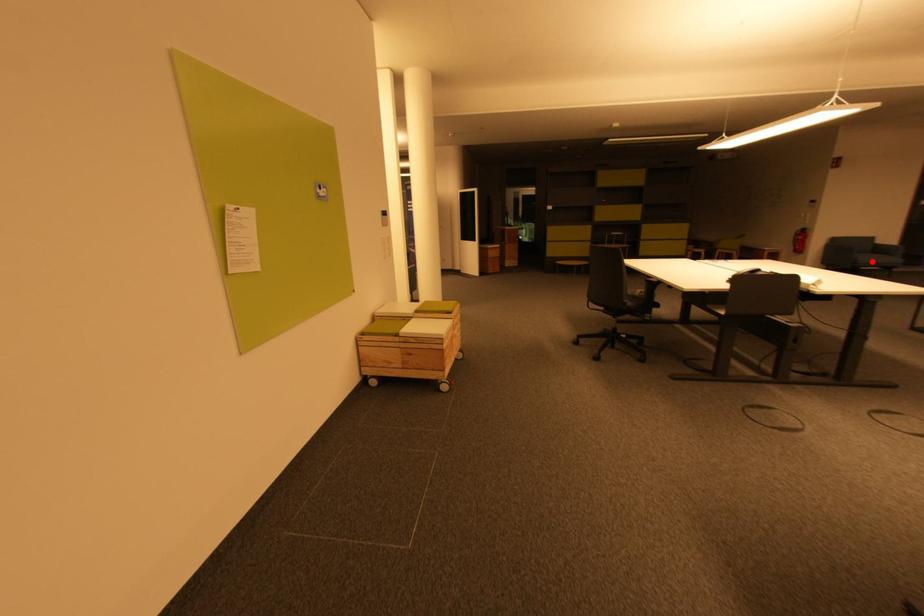
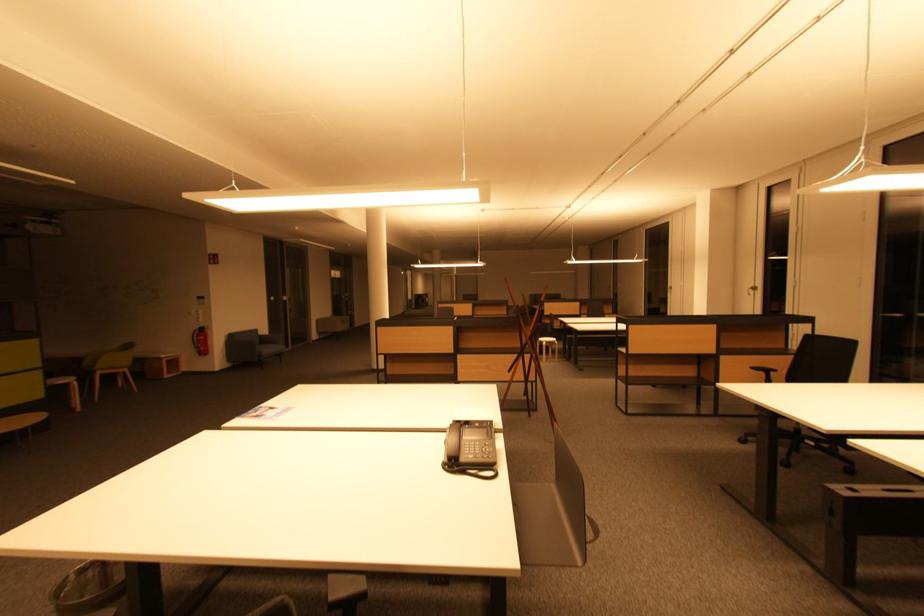
In the second image, find the point that corresponds to the highlighted location in the first image.

(272, 352)